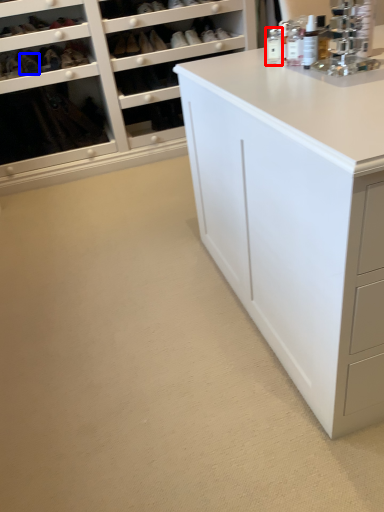
Question: Which point is further to the camera, toiletry (highlighted by a red box) or shoe (highlighted by a blue box)?

Choices:
 (A) toiletry
 (B) shoe

Answer: (B)